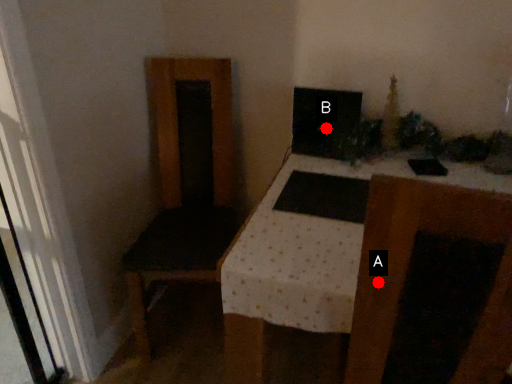
Question: Two points are circled on the image, labeled by A and B beside each circle. Which point appears closest to the camera in this image?

Choices:
 (A) A is closer
 (B) B is closer

Answer: (A)